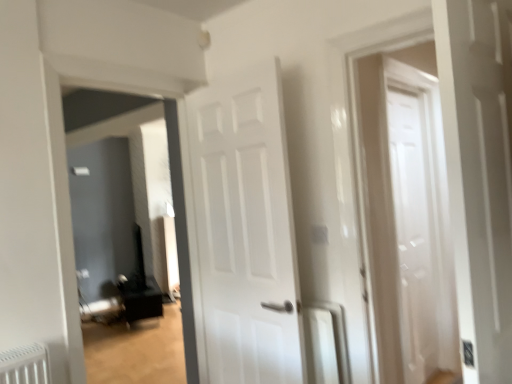
Question: Is white glossy door at center in front of or behind white glossy radiator at center in the image?

Choices:
 (A) front
 (B) behind

Answer: (A)

Question: Is white glossy door at center inside or outside of white glossy radiator at center?

Choices:
 (A) inside
 (B) outside

Answer: (B)

Question: Which object is the farthest from the white glossy door at center?

Choices:
 (A) white glossy radiator at center
 (B) matte black speaker at left

Answer: (B)

Question: Considering the real-world distances, which object is closest to the matte black speaker at left?

Choices:
 (A) white glossy door at center
 (B) white glossy radiator at center

Answer: (A)